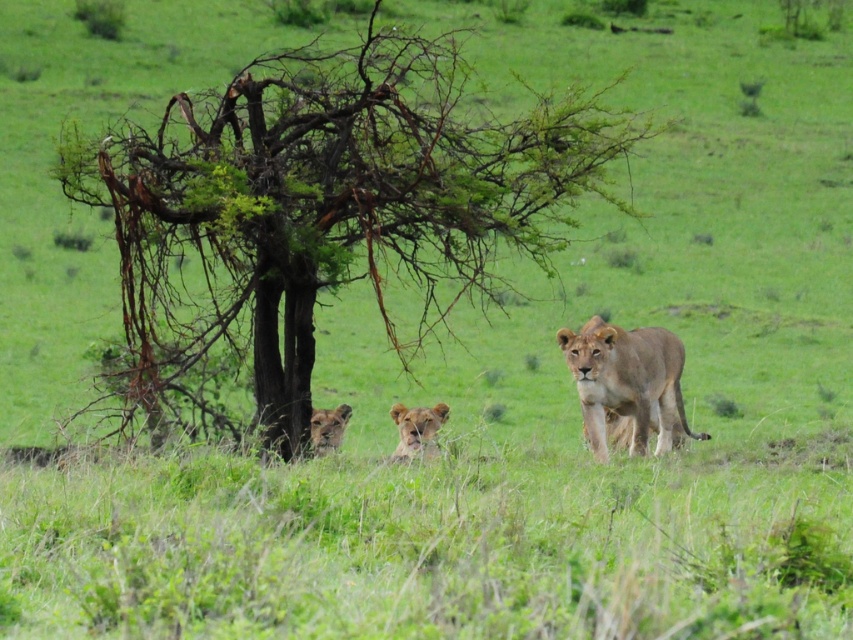
Consider the image. How much distance is there between green leafy tree at center and golden fur lion at lower center?

green leafy tree at center is 3.57 meters away from golden fur lion at lower center.

The image size is (853, 640). Describe the element at coordinates (323, 208) in the screenshot. I see `green leafy tree at center` at that location.

This screenshot has height=640, width=853. I want to click on green leafy tree at center, so click(323, 208).

Does green leafy tree at center have a smaller size compared to golden fur lion at center?

Incorrect, green leafy tree at center is not smaller in size than golden fur lion at center.

The image size is (853, 640). I want to click on green leafy tree at center, so click(323, 208).

The height and width of the screenshot is (640, 853). I want to click on green leafy tree at center, so click(x=323, y=208).

Which is more to the right, golden brown fur lion at center or golden fur lion at lower center?

From the viewer's perspective, golden brown fur lion at center appears more on the right side.

In order to click on golden brown fur lion at center in this screenshot , I will do `click(625, 381)`.